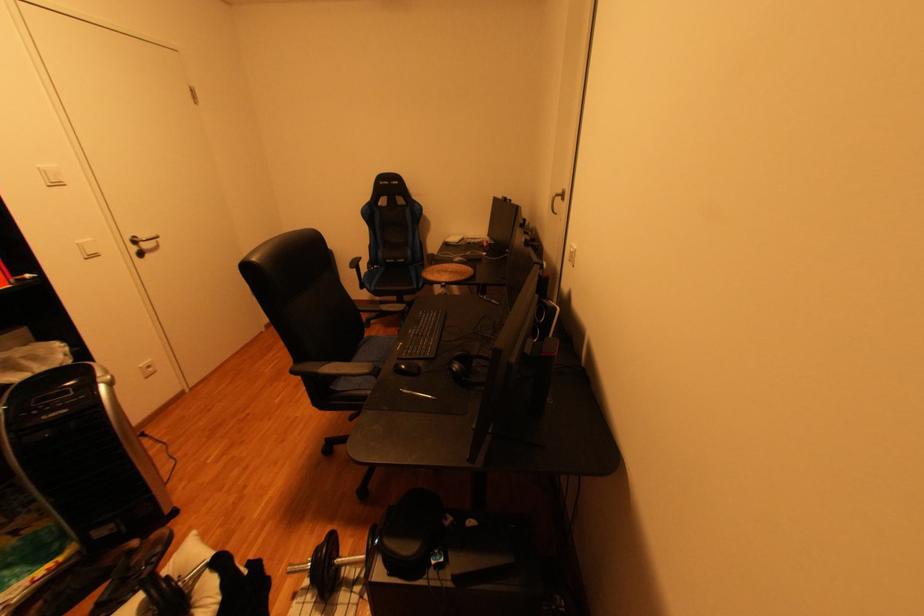
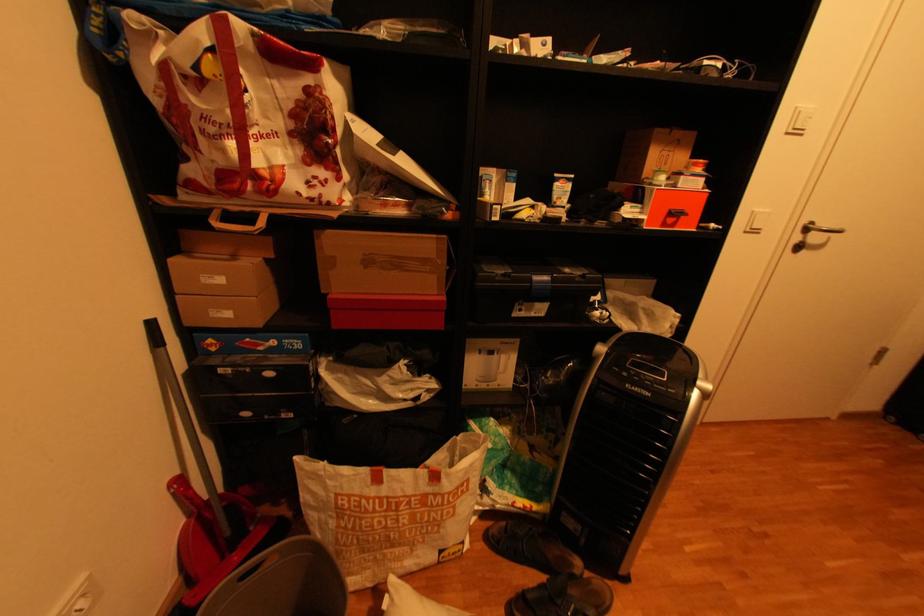
Where in the second image is the point corresponding to point 89,243 from the first image?

(766, 209)